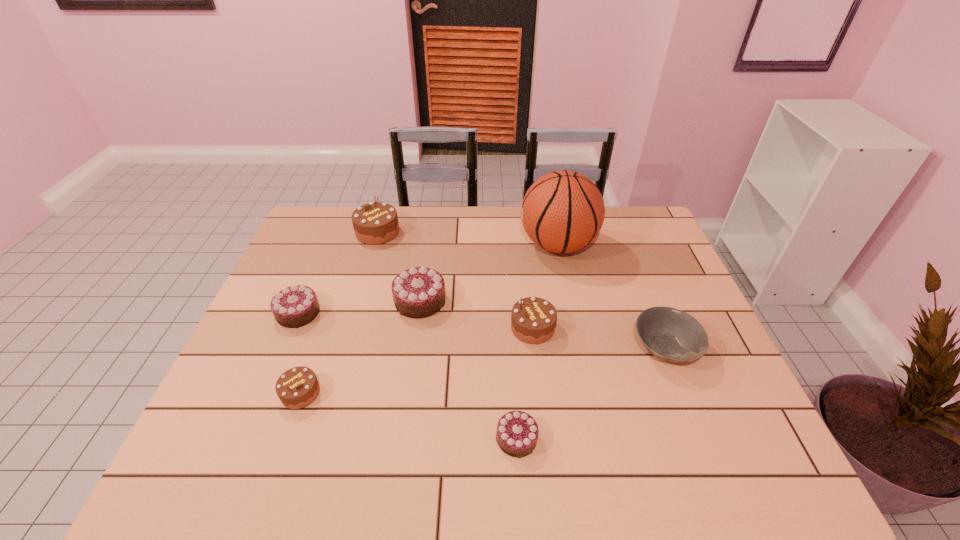
At what (x,y) coordinates should I click in order to perform the action: click on vacant space at the near edge of the desktop. Please return your answer as a coordinate pair (x, y). Looking at the image, I should click on (451, 461).

I want to click on free space at the left edge of the desktop, so click(x=262, y=316).

Find the location of a particular element. The height and width of the screenshot is (540, 960). free space at the right edge is located at coordinates (686, 406).

Identify the location of vacant space at the near right corner. This screenshot has width=960, height=540. (692, 453).

Find the location of a particular element. Image resolution: width=960 pixels, height=540 pixels. vacant region between the bowl and the rightmost brown chocolate cake is located at coordinates (599, 338).

Find the location of a particular element. vacant point located between the nearest chocolate cake and the smallest brown chocolate cake is located at coordinates (409, 416).

Where is `unoccupied area between the tallest object and the bowl`? The width and height of the screenshot is (960, 540). unoccupied area between the tallest object and the bowl is located at coordinates click(612, 296).

Find the location of `free spot between the nearest object and the smallest brown chocolate cake`. free spot between the nearest object and the smallest brown chocolate cake is located at coordinates (409, 416).

At what (x,y) coordinates should I click in order to perform the action: click on free area in between the second nearest chocolate cake and the biggest brown chocolate cake. Please return your answer as a coordinate pair (x, y). The height and width of the screenshot is (540, 960). Looking at the image, I should click on (339, 313).

This screenshot has height=540, width=960. I want to click on vacant point located between the second tallest object and the rightmost chocolate chocolate cake, so click(447, 335).